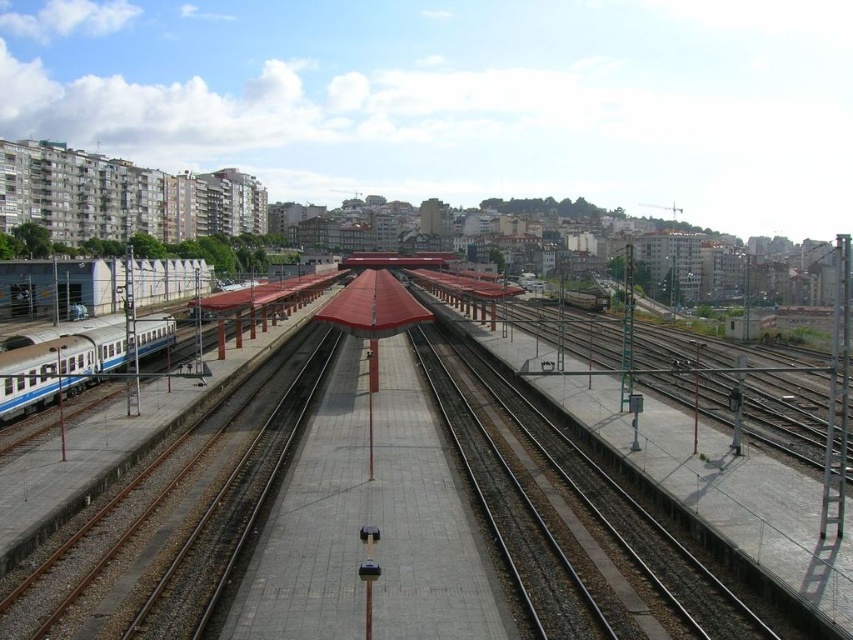
Which is in front, point (479, 394) or point (148, 336)?

Positioned in front is point (479, 394).

From the picture: Who is shorter, smooth concrete train track at center or silver metallic passenger train at left?

smooth concrete train track at center

Which is behind, point (641, 525) or point (42, 385)?

The point (42, 385) is behind.

Locate an element on the screen. smooth concrete train track at center is located at coordinates (567, 522).

Does metallic train tracks at center appear on the left side of smooth concrete train track at center?

Yes, metallic train tracks at center is to the left of smooth concrete train track at center.

Can you confirm if metallic train tracks at center is wider than smooth concrete train track at center?

Correct, the width of metallic train tracks at center exceeds that of smooth concrete train track at center.

At what (x,y) coordinates should I click in order to perform the action: click on metallic train tracks at center. Please return your answer as a coordinate pair (x, y). The image size is (853, 640). Looking at the image, I should click on (524, 524).

Identify the location of metallic train tracks at center. (524, 524).

Does point (540, 420) lie behind point (105, 356)?

No, (540, 420) is closer to viewer.

Who is more distant from viewer, (750, 630) or (16, 412)?

Point (16, 412)

Locate an element on the screen. metallic train tracks at center is located at coordinates (524, 524).